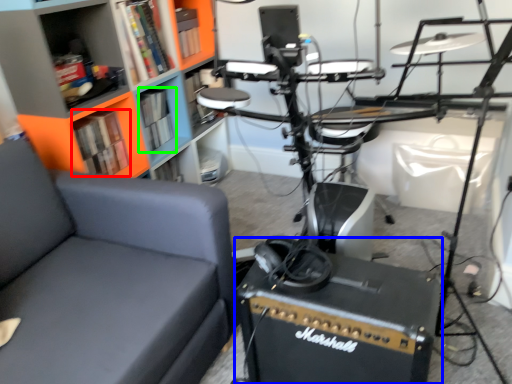
Question: Which is nearer to the book (highlighted by a red box)? equipment (highlighted by a blue box) or book (highlighted by a green box).

Choices:
 (A) equipment
 (B) book

Answer: (B)